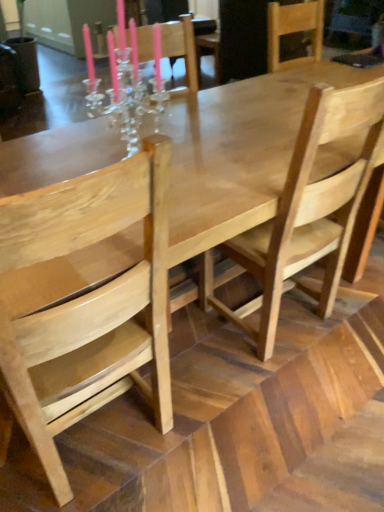
Question: From a real-world perspective, does natural wood chair at left, which is the 1th chair in left-to-right order, sit lower than light brown wood chair at center, which is counted as the second chair, starting from the left?

Choices:
 (A) no
 (B) yes

Answer: (B)

Question: Is natural wood chair at left, which is the 1th chair in left-to-right order, thinner than light brown wood chair at center, which is counted as the second chair, starting from the left?

Choices:
 (A) no
 (B) yes

Answer: (A)

Question: Considering the relative sizes of natural wood chair at left, which is the second chair from right to left, and light brown wood chair at center, which is counted as the second chair, starting from the left, in the image provided, is natural wood chair at left, which is the second chair from right to left, smaller than light brown wood chair at center, which is counted as the second chair, starting from the left,?

Choices:
 (A) no
 (B) yes

Answer: (A)

Question: Is natural wood chair at left, which is the 1th chair in left-to-right order, far away from light brown wood chair at center, the 1th chair when ordered from right to left?

Choices:
 (A) yes
 (B) no

Answer: (B)

Question: Considering the relative sizes of natural wood chair at left, which is the second chair from right to left, and light brown wood chair at center, which is counted as the second chair, starting from the left, in the image provided, is natural wood chair at left, which is the second chair from right to left, shorter than light brown wood chair at center, which is counted as the second chair, starting from the left,?

Choices:
 (A) no
 (B) yes

Answer: (B)

Question: Considering the relative sizes of natural wood chair at left, which is the second chair from right to left, and light brown wood chair at center, which is counted as the second chair, starting from the left, in the image provided, is natural wood chair at left, which is the second chair from right to left, taller than light brown wood chair at center, which is counted as the second chair, starting from the left,?

Choices:
 (A) no
 (B) yes

Answer: (A)

Question: Is light brown wood chair at center, the 1th chair when ordered from right to left, not inside natural wood chair at left, which is the second chair from right to left?

Choices:
 (A) no
 (B) yes

Answer: (B)

Question: Is light brown wood chair at center, the 1th chair when ordered from right to left, taller than natural wood chair at left, which is the 1th chair in left-to-right order?

Choices:
 (A) no
 (B) yes

Answer: (B)

Question: From a real-world perspective, does light brown wood chair at center, the 1th chair when ordered from right to left, stand above natural wood chair at left, which is the 1th chair in left-to-right order?

Choices:
 (A) no
 (B) yes

Answer: (B)

Question: From a real-world perspective, is light brown wood chair at center, the 1th chair when ordered from right to left, beneath natural wood chair at left, which is the second chair from right to left?

Choices:
 (A) yes
 (B) no

Answer: (B)

Question: Considering the relative sizes of light brown wood chair at center, which is counted as the second chair, starting from the left, and natural wood chair at left, which is the second chair from right to left, in the image provided, is light brown wood chair at center, which is counted as the second chair, starting from the left, smaller than natural wood chair at left, which is the second chair from right to left,?

Choices:
 (A) no
 (B) yes

Answer: (B)

Question: Is light brown wood chair at center, which is counted as the second chair, starting from the left, situated inside natural wood chair at left, which is the second chair from right to left, or outside?

Choices:
 (A) outside
 (B) inside

Answer: (A)